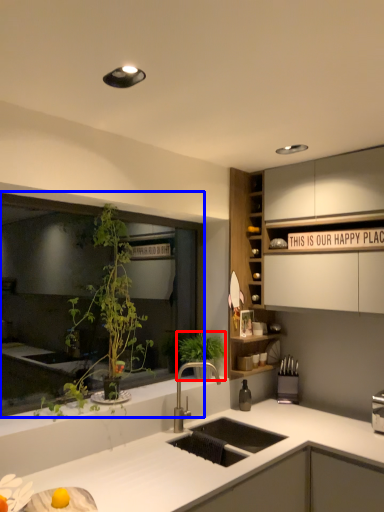
Question: Which object is further to the camera taking this photo, vegetation (highlighted by a red box) or window (highlighted by a blue box)?

Choices:
 (A) vegetation
 (B) window

Answer: (A)